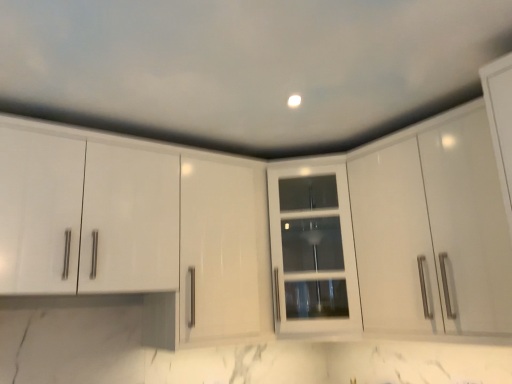
Question: Looking at their shapes, would you say white glass cabinet at center, which ranks as the first cabinetry in left-to-right order, is wider or thinner than glossy white cabinet at upper right, the first cabinetry positioned from the right?

Choices:
 (A) wide
 (B) thin

Answer: (A)

Question: Considering the positions of point (328, 321) and point (410, 196), is point (328, 321) closer or farther from the camera than point (410, 196)?

Choices:
 (A) closer
 (B) farther

Answer: (B)

Question: Visually, is white glass cabinet at center, which ranks as the first cabinetry in left-to-right order, positioned to the left or to the right of glossy white cabinet at upper right, which is counted as the second cabinetry, starting from the left?

Choices:
 (A) right
 (B) left

Answer: (B)

Question: Based on their sizes in the image, would you say glossy white cabinet at upper right, which is counted as the second cabinetry, starting from the left, is bigger or smaller than white glass cabinet at center, the 2th cabinetry when ordered from right to left?

Choices:
 (A) big
 (B) small

Answer: (A)

Question: Based on their positions, is glossy white cabinet at upper right, the first cabinetry positioned from the right, located to the left or right of white glass cabinet at center, the 2th cabinetry when ordered from right to left?

Choices:
 (A) right
 (B) left

Answer: (A)

Question: From their relative heights in the image, would you say glossy white cabinet at upper right, which is counted as the second cabinetry, starting from the left, is taller or shorter than white glass cabinet at center, the 2th cabinetry when ordered from right to left?

Choices:
 (A) short
 (B) tall

Answer: (B)

Question: From a real-world perspective, is glossy white cabinet at upper right, which is counted as the second cabinetry, starting from the left, positioned above or below white glass cabinet at center, the 2th cabinetry when ordered from right to left?

Choices:
 (A) below
 (B) above

Answer: (B)